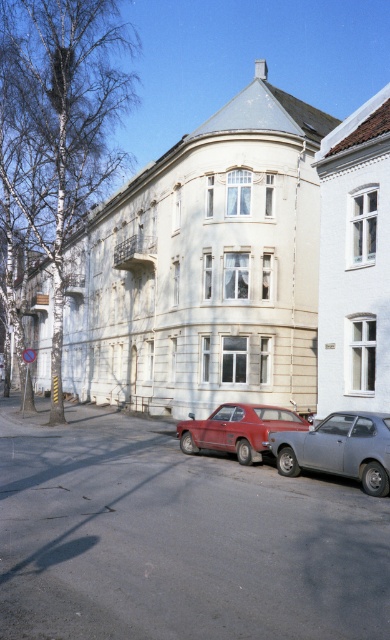
Question: Among these objects, which one is nearest to the camera?

Choices:
 (A) matte gray hatchback at center
 (B) matte red station wagon at center

Answer: (A)

Question: Does matte gray hatchback at center appear on the left side of matte red station wagon at center?

Choices:
 (A) yes
 (B) no

Answer: (B)

Question: Which object is closer to the camera taking this photo?

Choices:
 (A) matte gray hatchback at center
 (B) matte red station wagon at center

Answer: (A)

Question: Can you confirm if matte gray hatchback at center is bigger than matte red station wagon at center?

Choices:
 (A) no
 (B) yes

Answer: (B)

Question: Observing the image, what is the correct spatial positioning of matte gray hatchback at center in reference to matte red station wagon at center?

Choices:
 (A) right
 (B) left

Answer: (A)